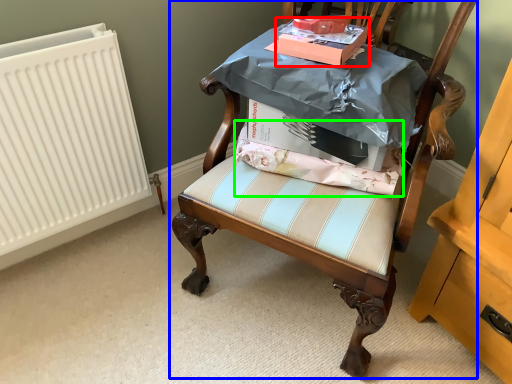
Question: Which object is positioned farthest from cardboard box (highlighted by a red box)? Select from chair (highlighted by a blue box) and fabric (highlighted by a green box).

Choices:
 (A) chair
 (B) fabric

Answer: (A)